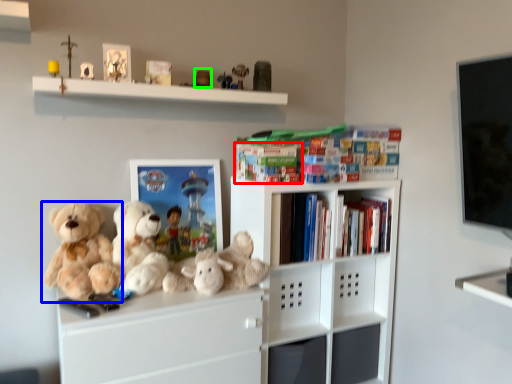
Question: Which object is positioned farthest from book (highlighted by a red box)? Select from teddy bear (highlighted by a blue box) and toy (highlighted by a green box).

Choices:
 (A) teddy bear
 (B) toy

Answer: (A)